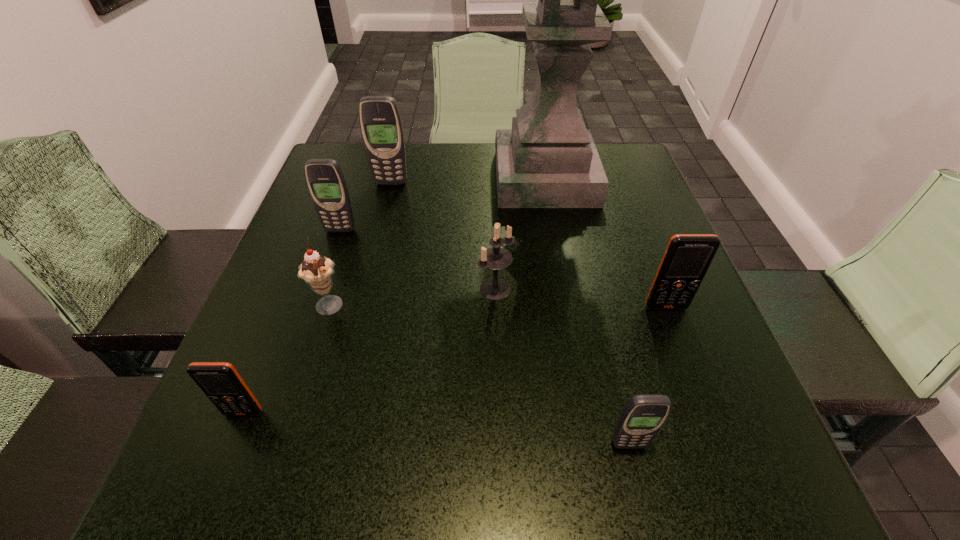
Locate an element on the screen. This screenshot has height=540, width=960. object that is at the far left corner is located at coordinates [381, 126].

Locate an element on the screen. The height and width of the screenshot is (540, 960). object that is at the far right corner is located at coordinates (549, 159).

The height and width of the screenshot is (540, 960). What are the coordinates of `vacant space at the far edge of the desktop` in the screenshot? It's located at (466, 190).

This screenshot has height=540, width=960. In order to click on free space at the near edge of the desktop in this screenshot , I will do `click(349, 462)`.

In the image, there is a desktop. Where is `free region at the left edge`? Image resolution: width=960 pixels, height=540 pixels. free region at the left edge is located at coordinates (336, 273).

Where is `vacant space at the right edge of the desktop`? vacant space at the right edge of the desktop is located at coordinates (708, 377).

Find the location of a particular element. The height and width of the screenshot is (540, 960). free space at the far left corner of the desktop is located at coordinates (339, 154).

The height and width of the screenshot is (540, 960). In the image, there is a desktop. What are the coordinates of `vacant space at the near left corner` in the screenshot? It's located at (264, 472).

Image resolution: width=960 pixels, height=540 pixels. Identify the location of vacant area at the far right corner. (603, 143).

This screenshot has width=960, height=540. Find the location of `free space at the near right corner`. free space at the near right corner is located at coordinates (780, 509).